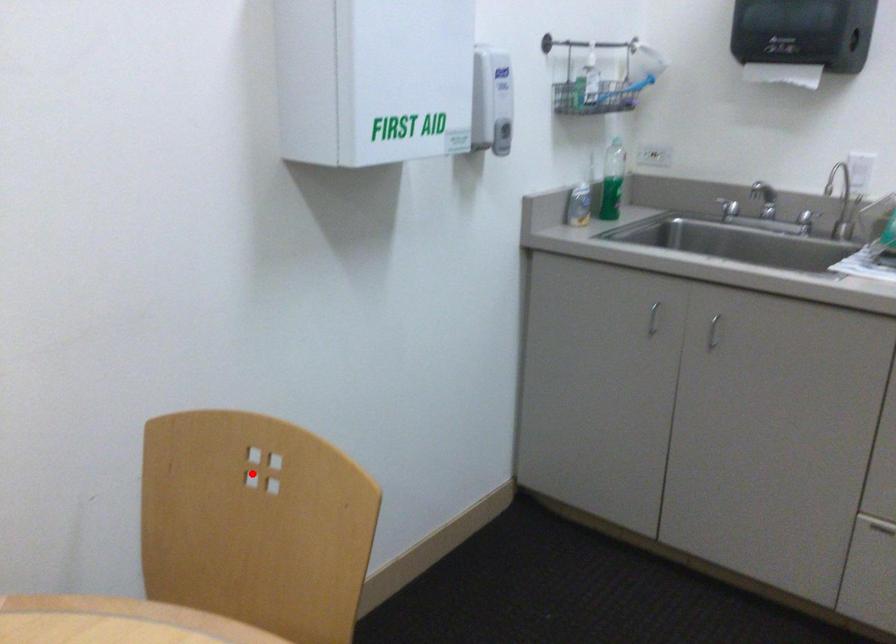
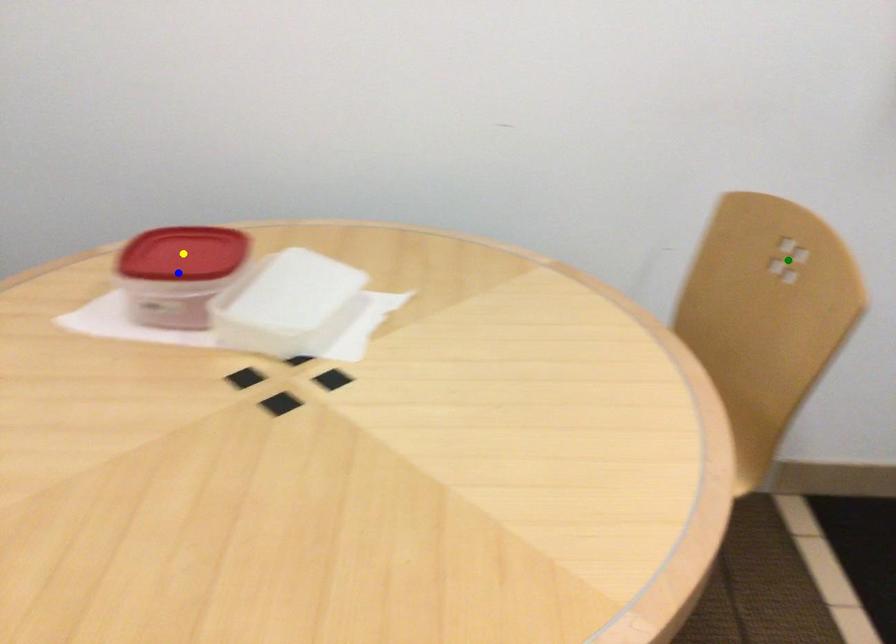
Question: I am providing you with two images of the same scene from different viewpoints. A red point is marked on the first image. You are given multiple points on the second image. Which point in image 2 is actually the same real-world point as the red point in image 1?

Choices:
 (A) blue point
 (B) green point
 (C) yellow point

Answer: (B)